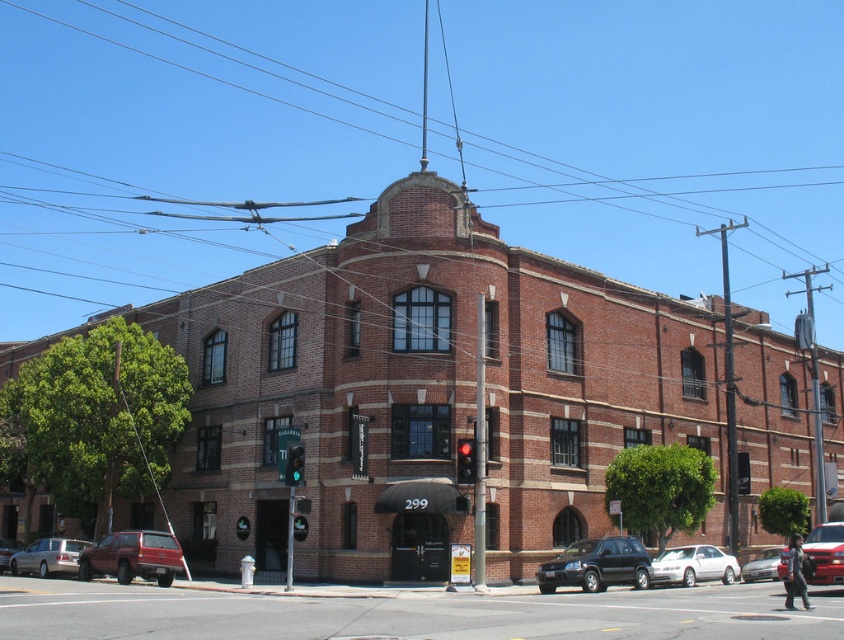
Consider the image. You are a delivery person needing to park your vehicle in the street. You see a matte red suv at lower left and a metallic red car at lower left. Which vehicle is closer to the curb?

The matte red suv at lower left is closer to the curb because it is in front of the metallic red car at lower left.

Consider the image. You are standing on the sidewalk in front of the brick building at center. If you walk straight ahead, will you be facing the entrance with the black awning displaying the number 299?

Yes, because the brick building at center is positioned such that its entrance with the black awning displaying the number 299 is directly in front of you when facing the building.

In the scene shown: You are driving a car and want to park in the space between the metallic silver van at center and the red glass traffic light at center. The parking space requires a minimum of 10 meters between the two markers. Can you fit your car there?

The metallic silver van at center and red glass traffic light at center are 12.94 meters apart, which exceeds the required 10 meters, so yes, you can fit your car in the parking space between them.